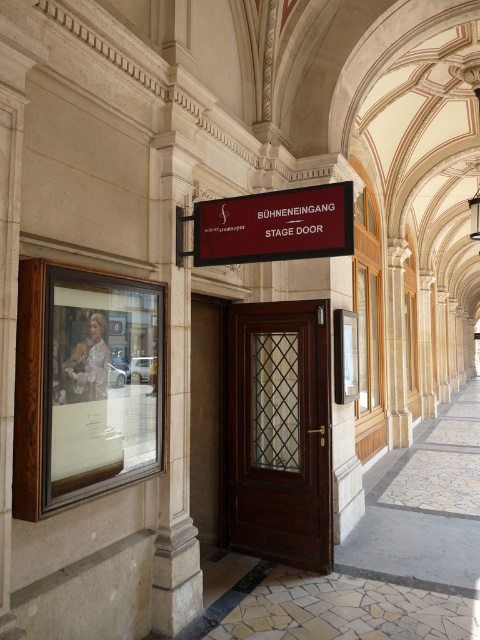
Can you confirm if dark wood door at center is positioned to the right of matte black sign at center?

Correct, you'll find dark wood door at center to the right of matte black sign at center.

Between dark wood door at center and matte black sign at center, which one appears on the left side from the viewer's perspective?

From the viewer's perspective, matte black sign at center appears more on the left side.

What do you see at coordinates (279, 433) in the screenshot?
I see `dark wood door at center` at bounding box center [279, 433].

In order to click on dark wood door at center in this screenshot , I will do `click(279, 433)`.